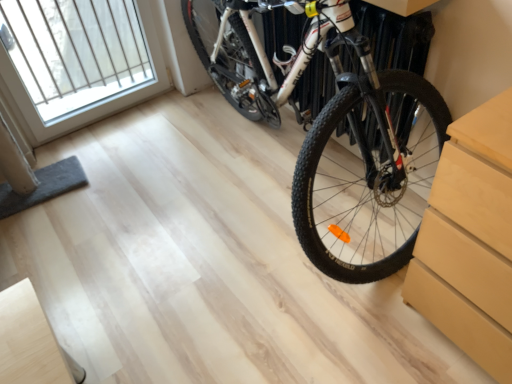
Question: Is shiny white bicycle at center in front of or behind white glass window at upper left in the image?

Choices:
 (A) front
 (B) behind

Answer: (A)

Question: In terms of width, does shiny white bicycle at center look wider or thinner when compared to white glass window at upper left?

Choices:
 (A) thin
 (B) wide

Answer: (B)

Question: In terms of size, does shiny white bicycle at center appear bigger or smaller than white glass window at upper left?

Choices:
 (A) small
 (B) big

Answer: (B)

Question: From a real-world perspective, is white glass window at upper left above or below shiny white bicycle at center?

Choices:
 (A) below
 (B) above

Answer: (A)

Question: Is white glass window at upper left inside the boundaries of shiny white bicycle at center, or outside?

Choices:
 (A) inside
 (B) outside

Answer: (B)

Question: From the image's perspective, relative to shiny white bicycle at center, is white glass window at upper left above or below?

Choices:
 (A) above
 (B) below

Answer: (A)

Question: Considering the positions of white glass window at upper left and shiny white bicycle at center in the image, is white glass window at upper left bigger or smaller than shiny white bicycle at center?

Choices:
 (A) small
 (B) big

Answer: (A)